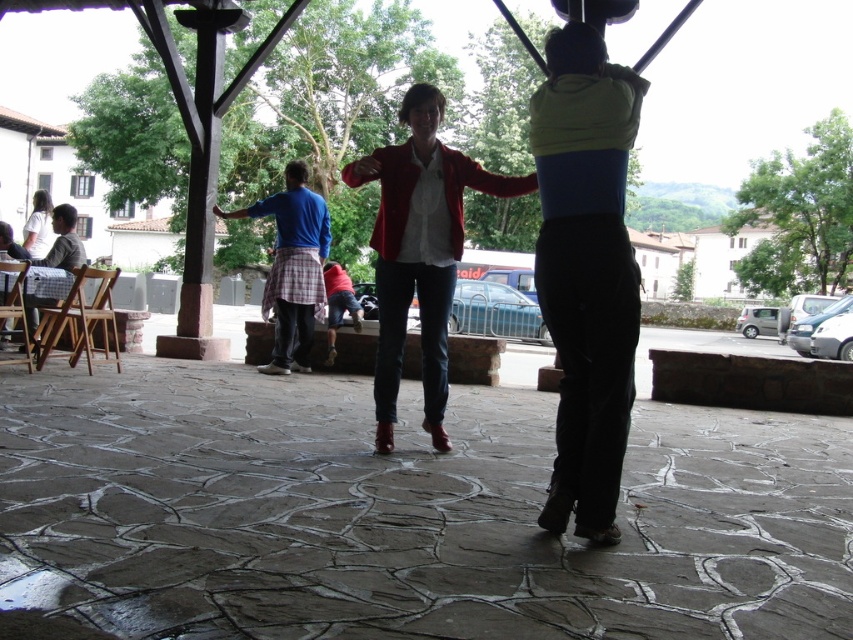
Who is higher up, matte red blazer at center or blue cotton shirt at center?

matte red blazer at center is above.

The image size is (853, 640). Describe the element at coordinates (419, 250) in the screenshot. I see `matte red blazer at center` at that location.

At what (x,y) coordinates should I click in order to perform the action: click on matte red blazer at center. Please return your answer as a coordinate pair (x, y). The width and height of the screenshot is (853, 640). Looking at the image, I should click on (419, 250).

Can you confirm if matte red blazer at center is positioned to the right of checkered fabric shirt at left?

Correct, you'll find matte red blazer at center to the right of checkered fabric shirt at left.

Is point (447, 440) positioned behind point (51, 262)?

No, it is not.

Where is `matte red blazer at center`? This screenshot has width=853, height=640. matte red blazer at center is located at coordinates (419, 250).

Consider the image. Between matte red blazer at center and white matte shirt at upper left, which one has less height?

With less height is matte red blazer at center.

Who is more forward, [376,282] or [41,230]?

Positioned in front is point [376,282].

Locate an element on the screen. This screenshot has height=640, width=853. matte red blazer at center is located at coordinates (419, 250).